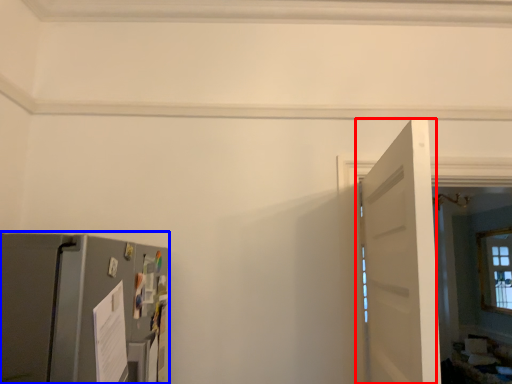
Question: Which point is further to the camera, door (highlighted by a red box) or appliance (highlighted by a blue box)?

Choices:
 (A) door
 (B) appliance

Answer: (A)